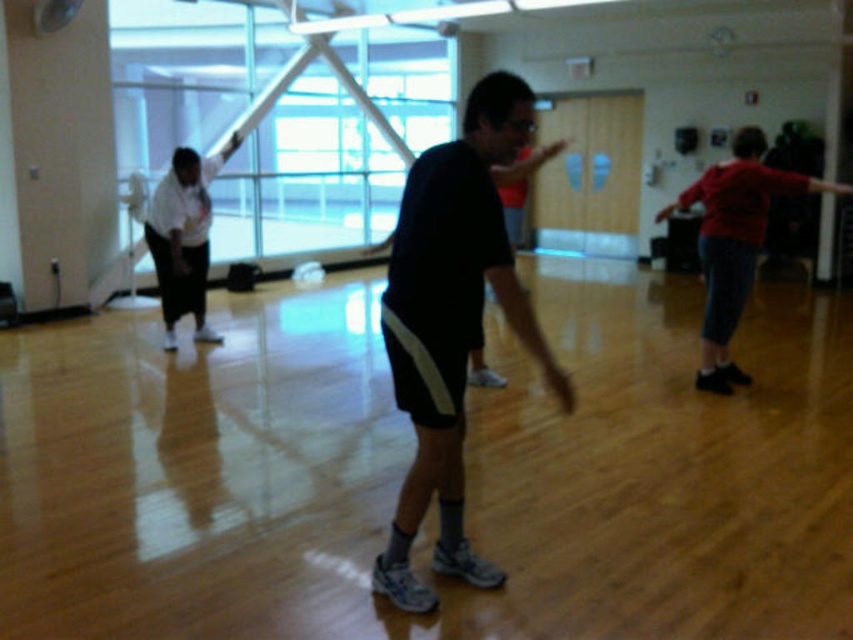
You are a photographer setting up for a group photo in the room. You need to ensure that the dark blue jersey at center and the white matte shirt at left are both visible in the frame. Considering their heights, which object should you adjust the camera angle to focus on first?

The dark blue jersey at center has a lesser height compared to white matte shirt at left, so you should adjust the camera angle to focus on the dark blue jersey at center first to ensure it is fully visible in the frame.

You are a photographer standing at the back of the room. You need to capture a photo of both the dark blue jersey at center and the white matte shirt at left. Can you see both objects in your camera frame at the same time?

The dark blue jersey at center is positioned under the white matte shirt at left, so yes, both objects can be seen in the camera frame simultaneously.

You are organizing a closet and need to place the dark blue jersey at center and the white matte shirt at left on a shelf. Based on their sizes, which one should you place first to maximize space efficiency?

The dark blue jersey at center is wider than the white matte shirt at left, so you should place the dark blue jersey at center first to utilize the shelf space effectively.